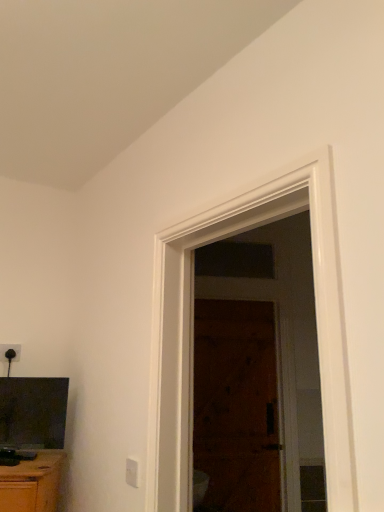
Question: Are wooden door at center and white plastic electric outlet at lower center, which is the 2th electric outlet in back-to-front order, located far from each other?

Choices:
 (A) yes
 (B) no

Answer: (A)

Question: From a real-world perspective, is wooden door at center over white plastic electric outlet at lower center, which is counted as the second electric outlet, starting from the top?

Choices:
 (A) no
 (B) yes

Answer: (B)

Question: Considering the relative positions of wooden door at center and white plastic electric outlet at lower center, which is the 2th electric outlet in back-to-front order, in the image provided, is wooden door at center in front of white plastic electric outlet at lower center, which is the 2th electric outlet in back-to-front order,?

Choices:
 (A) yes
 (B) no

Answer: (B)

Question: Can you confirm if wooden door at center is shorter than white plastic electric outlet at lower center, which is the 2th electric outlet in back-to-front order?

Choices:
 (A) no
 (B) yes

Answer: (A)

Question: Does wooden door at center have a smaller size compared to white plastic electric outlet at lower center, which is counted as the second electric outlet, starting from the top?

Choices:
 (A) yes
 (B) no

Answer: (B)

Question: Is white plastic electric outlet at lower center, which is counted as the second electric outlet, starting from the top, bigger or smaller than black plastic electric outlet at upper left, which appears as the second electric outlet when ordered from the bottom?

Choices:
 (A) big
 (B) small

Answer: (A)

Question: Do you think white plastic electric outlet at lower center, which is the 2th electric outlet in back-to-front order, is within black plastic electric outlet at upper left, which appears as the second electric outlet when ordered from the bottom, or outside of it?

Choices:
 (A) outside
 (B) inside

Answer: (A)

Question: Is white plastic electric outlet at lower center, the first electric outlet from the bottom, wider or thinner than black plastic electric outlet at upper left, which appears as the second electric outlet when ordered from the bottom?

Choices:
 (A) thin
 (B) wide

Answer: (A)

Question: From the image's perspective, is white plastic electric outlet at lower center, marked as the 1th electric outlet in a front-to-back arrangement, located above or below black plastic electric outlet at upper left, the first electric outlet viewed from the left?

Choices:
 (A) above
 (B) below

Answer: (B)

Question: Considering the positions of point (49, 380) and point (130, 459), is point (49, 380) closer or farther from the camera than point (130, 459)?

Choices:
 (A) closer
 (B) farther

Answer: (B)

Question: Relative to white plastic electric outlet at lower center, which is the 2th electric outlet in back-to-front order, is matte black tv at lower left in front or behind?

Choices:
 (A) front
 (B) behind

Answer: (B)

Question: From a real-world perspective, relative to white plastic electric outlet at lower center, the first electric outlet from the bottom, is matte black tv at lower left vertically above or below?

Choices:
 (A) below
 (B) above

Answer: (B)

Question: From the image's perspective, is matte black tv at lower left above or below white plastic electric outlet at lower center, which is the 2th electric outlet in back-to-front order?

Choices:
 (A) above
 (B) below

Answer: (A)

Question: In terms of height, does wooden door at center look taller or shorter compared to white plastic electric outlet at lower center, marked as the 1th electric outlet in a front-to-back arrangement?

Choices:
 (A) short
 (B) tall

Answer: (B)

Question: Considering the positions of wooden door at center and white plastic electric outlet at lower center, marked as the 1th electric outlet in a front-to-back arrangement, in the image, is wooden door at center wider or thinner than white plastic electric outlet at lower center, marked as the 1th electric outlet in a front-to-back arrangement,?

Choices:
 (A) wide
 (B) thin

Answer: (A)